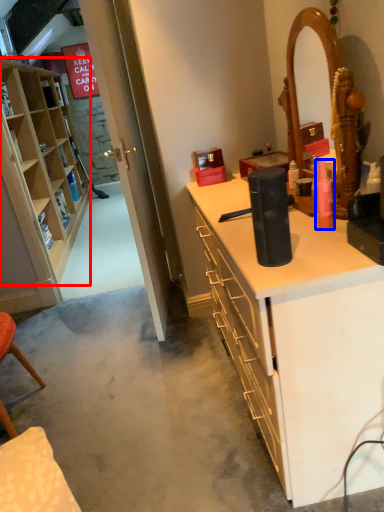
Question: Which object appears farthest to the camera in this image, cabinetry (highlighted by a red box) or toiletry (highlighted by a blue box)?

Choices:
 (A) cabinetry
 (B) toiletry

Answer: (A)